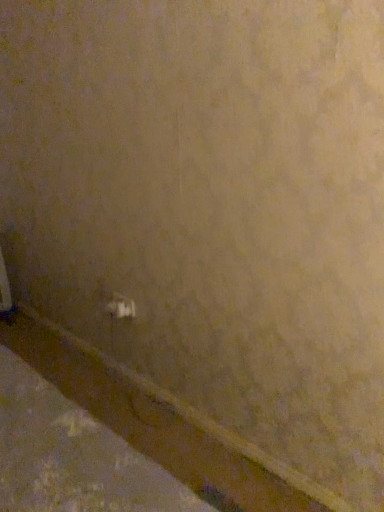
Question: Are white plastic power plugs and sockets at lower center and white matte molding at lower left beside each other?

Choices:
 (A) yes
 (B) no

Answer: (B)

Question: Can you confirm if white plastic power plugs and sockets at lower center is thinner than white matte molding at lower left?

Choices:
 (A) no
 (B) yes

Answer: (B)

Question: Is white plastic power plugs and sockets at lower center positioned behind white matte molding at lower left?

Choices:
 (A) no
 (B) yes

Answer: (B)

Question: Does white plastic power plugs and sockets at lower center appear on the left side of white matte molding at lower left?

Choices:
 (A) no
 (B) yes

Answer: (A)

Question: Can you confirm if white plastic power plugs and sockets at lower center is bigger than white matte molding at lower left?

Choices:
 (A) no
 (B) yes

Answer: (A)

Question: Is white plastic power plugs and sockets at lower center wider than white matte molding at lower left?

Choices:
 (A) no
 (B) yes

Answer: (A)

Question: From a real-world perspective, does white matte molding at lower left sit lower than white plastic power plugs and sockets at lower center?

Choices:
 (A) no
 (B) yes

Answer: (B)

Question: Is the surface of white matte molding at lower left in direct contact with white plastic power plugs and sockets at lower center?

Choices:
 (A) no
 (B) yes

Answer: (A)

Question: From a real-world perspective, is white matte molding at lower left on top of white plastic power plugs and sockets at lower center?

Choices:
 (A) yes
 (B) no

Answer: (B)

Question: Is white matte molding at lower left positioned with its back to white plastic power plugs and sockets at lower center?

Choices:
 (A) no
 (B) yes

Answer: (A)

Question: From the image's perspective, does white matte molding at lower left appear lower than white plastic power plugs and sockets at lower center?

Choices:
 (A) yes
 (B) no

Answer: (A)

Question: Would you say white matte molding at lower left is outside white plastic power plugs and sockets at lower center?

Choices:
 (A) no
 (B) yes

Answer: (B)

Question: Considering the positions of point (311, 496) and point (115, 295), is point (311, 496) closer or farther from the camera than point (115, 295)?

Choices:
 (A) farther
 (B) closer

Answer: (B)